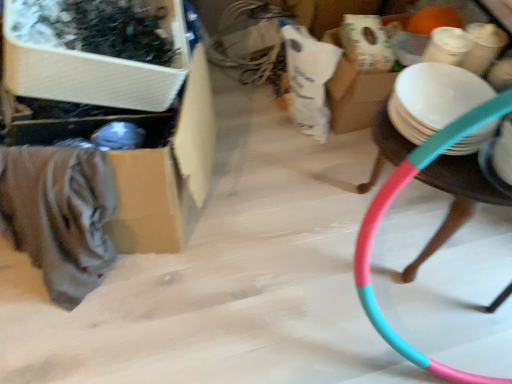
Locate an element on the screen. vacant area on top of white matte plate at right (from a real-world perspective) is located at coordinates (447, 93).